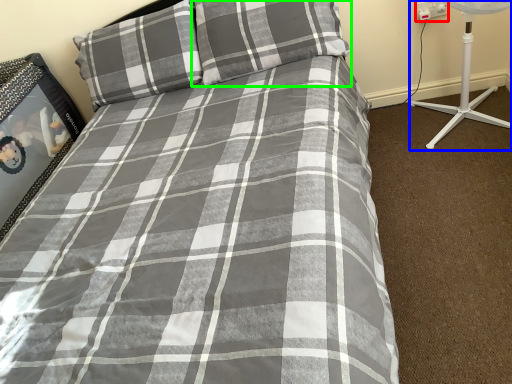
Question: Estimate the real-world distances between objects in this image. Which object is farther from electric outlet (highlighted by a red box), fan (highlighted by a blue box) or pillow (highlighted by a green box)?

Choices:
 (A) fan
 (B) pillow

Answer: (B)